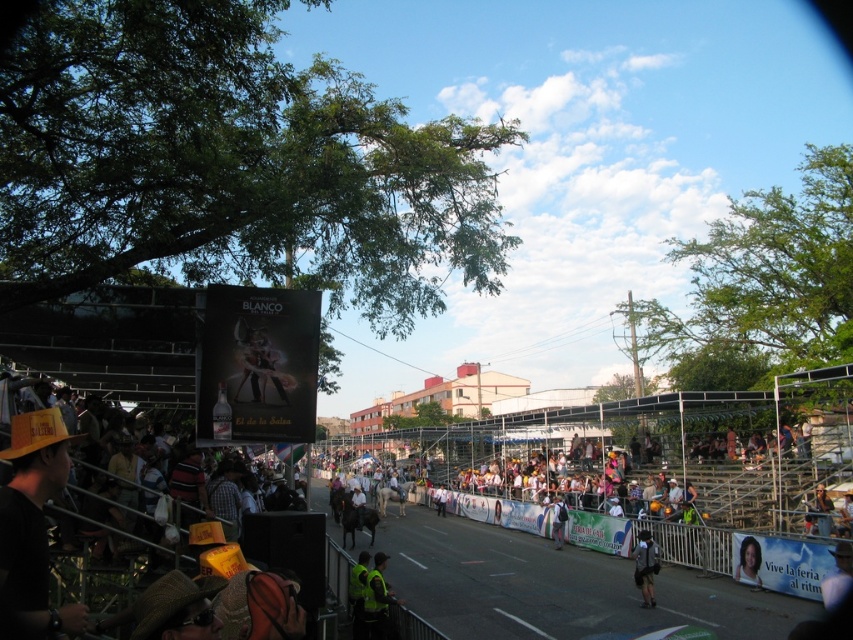
Question: Which of the following is the farthest from the observer?

Choices:
 (A) (554, 528)
 (B) (646, 532)
 (C) (500, 579)

Answer: (A)

Question: Which object is closer to the camera taking this photo?

Choices:
 (A) smooth asphalt road at center
 (B) smooth skin portrait at center
 (C) dark blue backpack at center

Answer: (A)

Question: Can you confirm if smooth skin portrait at center is bigger than dark blue backpack at center?

Choices:
 (A) yes
 (B) no

Answer: (B)

Question: Does smooth asphalt road at center have a larger size compared to white fabric shirt at center?

Choices:
 (A) no
 (B) yes

Answer: (B)

Question: Which is farther from the dark blue backpack at center?

Choices:
 (A) smooth asphalt road at center
 (B) smooth skin portrait at center
 (C) white fabric shirt at center
 (D) dark gray backpack at lower center

Answer: (C)

Question: Can you confirm if dark gray backpack at lower center is thinner than smooth skin portrait at center?

Choices:
 (A) yes
 (B) no

Answer: (B)